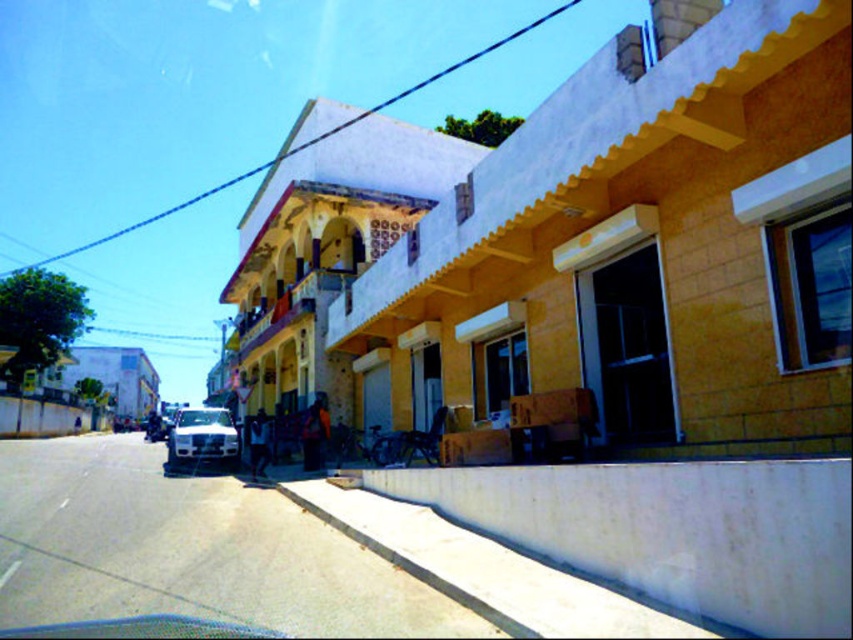
You are a delivery person trying to park your white glossy car at center in front of the building with the open wooden door. The white concrete curb at lower center is in the way. Can you park your car there without hitting the curb?

The white concrete curb at lower center is smaller than the white glossy car at center, so yes, you can park the white glossy car at center there without hitting the curb since the curb is not large enough to block the parking space.

You are a pedestrian standing on the sidewalk and want to cross the street to reach the building with the wooden door on the right. There is a white glossy car at center and a shiny silver motorcycle at center in your path. Which vehicle should you move around first to avoid them?

You should move around the white glossy car at center first because it is closer to you than the shiny silver motorcycle at center.

You are a delivery person trying to park your white glossy car at center in a spot between the white concrete curb at lower center and the building on the right. Can you fit the car there if the curb is to the right of the car?

The white concrete curb at lower center is positioned on the right side of the white glossy car at center, so there is space between the car and the building on the right. However, since the curb is already to the right of the car, the parking spot might be too narrow for the car to fit comfortably between them.